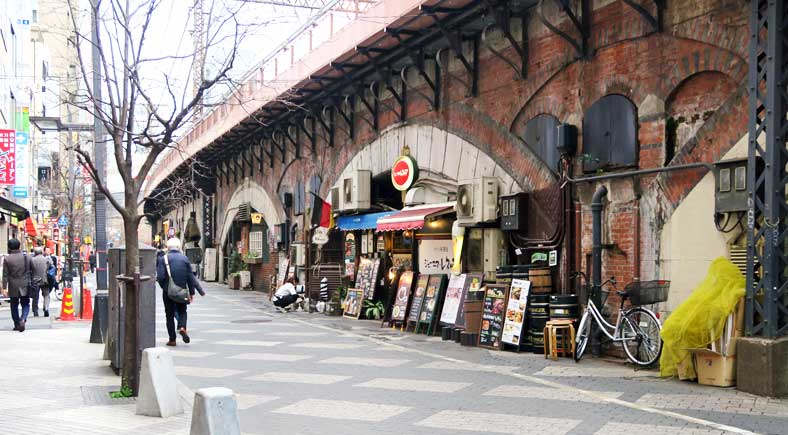
What are the coordinates of `small stool` in the screenshot? It's located at (547, 326).